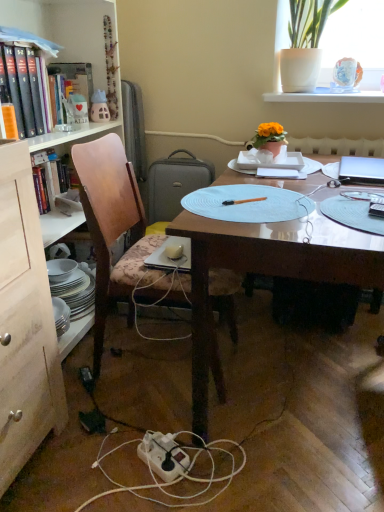
Find the location of a particular element. The height and width of the screenshot is (512, 384). unoccupied area behind white plastic power plugs and sockets at lower center, which ranks as the 2th power plugs and sockets in top-to-bottom order is located at coordinates (106, 393).